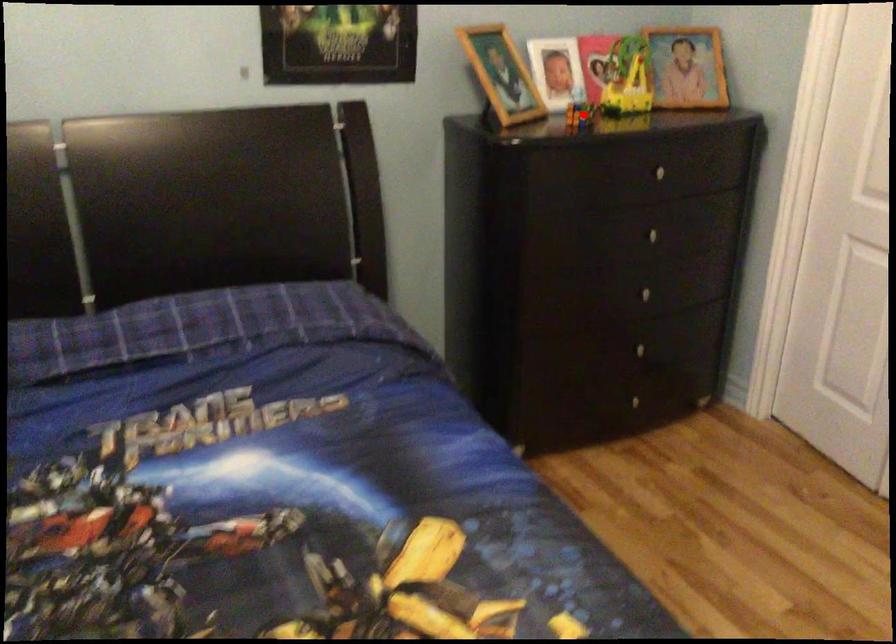
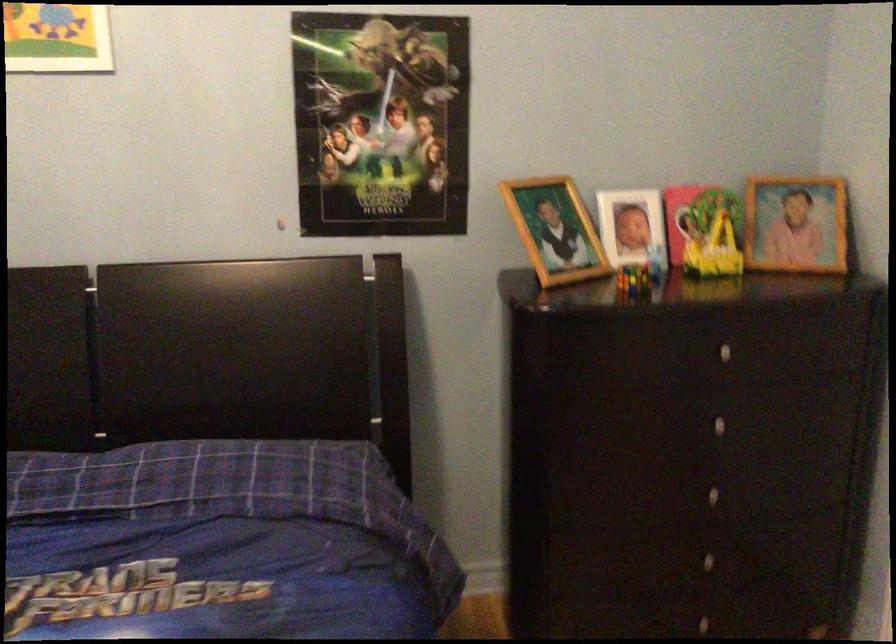
In the second image, find the point that corresponds to the highlighted location in the first image.

(634, 279)